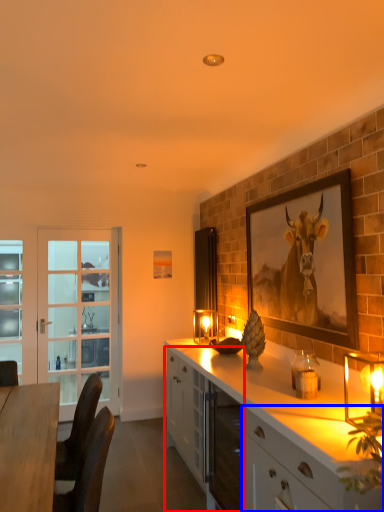
Question: Which of the following is the farthest to the observer, cabinetry (highlighted by a red box) or cabinetry (highlighted by a blue box)?

Choices:
 (A) cabinetry
 (B) cabinetry

Answer: (A)